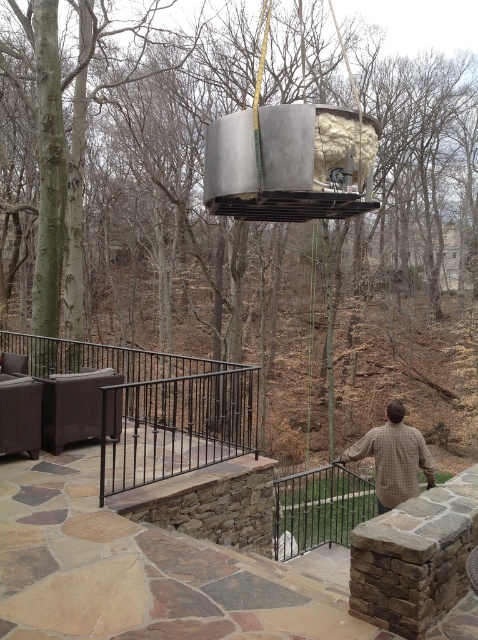
Question: Does brown bark tree at upper left appear under brown wicker sofa at lower left?

Choices:
 (A) yes
 (B) no

Answer: (B)

Question: In this image, where is brown plaid shirt at upper center located relative to brown woven ottoman at lower left?

Choices:
 (A) below
 (B) above

Answer: (A)

Question: Among these points, which one is farthest from the camera?

Choices:
 (A) (317, 490)
 (B) (269, 120)
 (C) (231, 225)
 (D) (56, 376)

Answer: (C)

Question: Does metallic gray swing at center appear on the right side of brown wicker sofa at lower left?

Choices:
 (A) yes
 (B) no

Answer: (A)

Question: Which point is farther to the camera?

Choices:
 (A) brown plaid shirt at upper center
 (B) brown woven ottoman at lower left
 (C) black wrought iron railing at lower center
 (D) brown wicker sofa at lower left

Answer: (D)

Question: Estimate the real-world distances between objects in this image. Which object is closer to the black metal railing at lower center?

Choices:
 (A) brown woven ottoman at lower left
 (B) brown plaid shirt at upper center
 (C) brown wicker sofa at lower left
 (D) brown bark tree at upper left

Answer: (B)